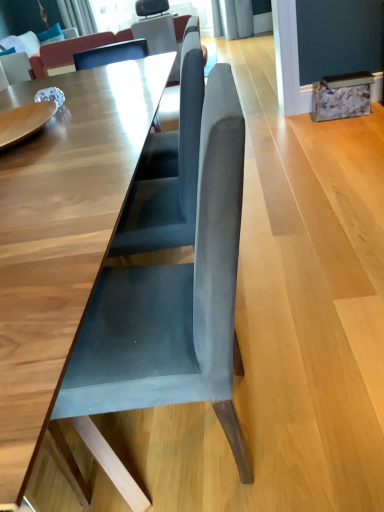
Image resolution: width=384 pixels, height=512 pixels. In order to click on suede gray chair at center in this screenshot , I will do `click(171, 311)`.

What is the approximate height of velvet blue couch at upper left, placed as the 2th couch when sorted from right to left?

The height of velvet blue couch at upper left, placed as the 2th couch when sorted from right to left, is 54.67 centimeters.

Where is `velvet blue couch at upper left, which appears as the 1th couch when viewed from the back`? velvet blue couch at upper left, which appears as the 1th couch when viewed from the back is located at coordinates (33, 53).

Locate an element on the screen. Image resolution: width=384 pixels, height=512 pixels. suede couch at upper center, which is the 1th couch in front-to-back order is located at coordinates (71, 51).

Could you tell me if suede gray chair at center is turned towards suede couch at upper center, which appears as the first couch when viewed from the right?

No.

Does point (150, 267) appear closer or farther from the camera than point (84, 42)?

Point (150, 267) appears to be closer to the viewer than point (84, 42).

From a real-world perspective, is suede gray chair at center physically below suede couch at upper center, which is the 1th couch in front-to-back order?

Incorrect, from a real-world perspective, suede gray chair at center is higher than suede couch at upper center, which is the 1th couch in front-to-back order.

Choose the correct answer: Is suede gray chair at center inside suede couch at upper center, the second couch from the back, or outside it?

suede gray chair at center is not inside suede couch at upper center, the second couch from the back, it's outside.

Considering the positions of objects velvet blue couch at upper left, which appears as the 1th couch when viewed from the back, and suede gray chair at center in the image provided, who is more to the right, velvet blue couch at upper left, which appears as the 1th couch when viewed from the back, or suede gray chair at center?

suede gray chair at center.

Can you confirm if velvet blue couch at upper left, arranged as the second couch when viewed from the front, is bigger than suede gray chair at center?

Yes.

Locate an element on the screen. couch that is the 2nd object to the left of the suede gray chair at center, starting at the anchor is located at coordinates (33, 53).

Is velvet blue couch at upper left, marked as the 1th couch in a left-to-right arrangement, not close to suede gray chair at center?

Indeed, velvet blue couch at upper left, marked as the 1th couch in a left-to-right arrangement, is not near suede gray chair at center.

From the image's perspective, is suede couch at upper center, the second couch from the back, above velvet blue couch at upper left, marked as the 1th couch in a left-to-right arrangement?

No, from the image's perspective, suede couch at upper center, the second couch from the back, is not above velvet blue couch at upper left, marked as the 1th couch in a left-to-right arrangement.

Locate an element on the screen. Image resolution: width=384 pixels, height=512 pixels. couch below the velvet blue couch at upper left, arranged as the second couch when viewed from the front (from a real-world perspective) is located at coordinates (71, 51).

Is suede couch at upper center, which appears as the first couch when viewed from the right, in contact with velvet blue couch at upper left, marked as the 1th couch in a left-to-right arrangement?

No, suede couch at upper center, which appears as the first couch when viewed from the right, is not next to velvet blue couch at upper left, marked as the 1th couch in a left-to-right arrangement.

Is suede couch at upper center, placed as the second couch when sorted from left to right, to the right of velvet blue couch at upper left, arranged as the second couch when viewed from the front, from the viewer's perspective?

Indeed, suede couch at upper center, placed as the second couch when sorted from left to right, is positioned on the right side of velvet blue couch at upper left, arranged as the second couch when viewed from the front.

Considering the positions of point (211, 362) and point (72, 33), is point (211, 362) closer or farther from the camera than point (72, 33)?

Point (211, 362) is closer to the camera than point (72, 33).

Where is `couch that is the 2nd one when counting upward from the suede gray chair at center (from the image's perspective)`? Image resolution: width=384 pixels, height=512 pixels. couch that is the 2nd one when counting upward from the suede gray chair at center (from the image's perspective) is located at coordinates (33, 53).

From the picture: Is suede gray chair at center at the left side of velvet blue couch at upper left, placed as the 2th couch when sorted from right to left?

Incorrect, suede gray chair at center is not on the left side of velvet blue couch at upper left, placed as the 2th couch when sorted from right to left.

You are a GUI agent. You are given a task and a screenshot of the screen. Output one action in this format:
    pyautogui.click(x=<x>, y=<y>)
    Task: Click on the chair that appears below the suede couch at upper center, placed as the second couch when sorted from left to right (from the image's perspective)
    This screenshot has width=384, height=512.
    Given the screenshot: What is the action you would take?
    pyautogui.click(x=171, y=311)

From a real-world perspective, who is located higher, suede couch at upper center, placed as the second couch when sorted from left to right, or suede gray chair at center?

suede gray chair at center is physically above.

Can you confirm if suede couch at upper center, the second couch from the back, is positioned to the right of suede gray chair at center?

No, suede couch at upper center, the second couch from the back, is not to the right of suede gray chair at center.

Which object is thinner, suede couch at upper center, placed as the second couch when sorted from left to right, or suede gray chair at center?

Thinner between the two is suede gray chair at center.

Locate an element on the screen. couch below the velvet blue couch at upper left, which appears as the 1th couch when viewed from the back (from the image's perspective) is located at coordinates (71, 51).

Does point (36, 51) come closer to viewer compared to point (59, 64)?

No, it is not.

Does velvet blue couch at upper left, arranged as the second couch when viewed from the front, touch suede couch at upper center, the second couch from the back?

No.

The height and width of the screenshot is (512, 384). Identify the location of chair located above the suede couch at upper center, the second couch from the back (from a real-world perspective). (171, 311).

Where is `chair below the velvet blue couch at upper left, arranged as the second couch when viewed from the front (from the image's perspective)`? This screenshot has height=512, width=384. chair below the velvet blue couch at upper left, arranged as the second couch when viewed from the front (from the image's perspective) is located at coordinates (171, 311).

When comparing their distances from suede gray chair at center, does velvet blue couch at upper left, placed as the 2th couch when sorted from right to left, or suede couch at upper center, which is the 1th couch in front-to-back order, seem closer?

Among the two, velvet blue couch at upper left, placed as the 2th couch when sorted from right to left, is located nearer to suede gray chair at center.

When comparing their distances from suede couch at upper center, placed as the second couch when sorted from left to right, does suede gray chair at center or velvet blue couch at upper left, marked as the 1th couch in a left-to-right arrangement, seem closer?

The object closer to suede couch at upper center, placed as the second couch when sorted from left to right, is velvet blue couch at upper left, marked as the 1th couch in a left-to-right arrangement.

Which object lies further to the anchor point velvet blue couch at upper left, arranged as the second couch when viewed from the front, suede gray chair at center or suede couch at upper center, placed as the second couch when sorted from left to right?

suede gray chair at center lies further to velvet blue couch at upper left, arranged as the second couch when viewed from the front, than the other object.

In the scene shown: Which object lies nearer to the anchor point velvet blue couch at upper left, marked as the 1th couch in a left-to-right arrangement, suede couch at upper center, which is the 1th couch in front-to-back order, or suede gray chair at center?

suede couch at upper center, which is the 1th couch in front-to-back order.

Based on their spatial positions, is velvet blue couch at upper left, which appears as the 1th couch when viewed from the back, or suede gray chair at center further from suede couch at upper center, placed as the second couch when sorted from left to right?

The object further to suede couch at upper center, placed as the second couch when sorted from left to right, is suede gray chair at center.

When comparing their distances from suede gray chair at center, does suede couch at upper center, which is the 1th couch in front-to-back order, or velvet blue couch at upper left, placed as the 2th couch when sorted from right to left, seem further?

suede couch at upper center, which is the 1th couch in front-to-back order, lies further to suede gray chair at center than the other object.

Locate an element on the screen. This screenshot has height=512, width=384. couch between suede gray chair at center and velvet blue couch at upper left, arranged as the second couch when viewed from the front, from front to back is located at coordinates (71, 51).